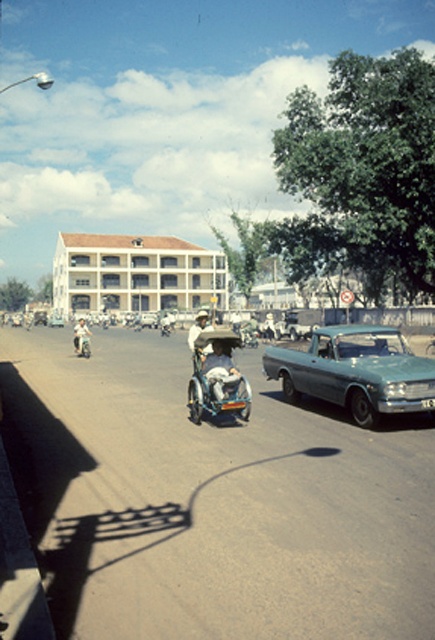
Looking at this image, can you confirm if light brown leather jacket at center is positioned to the right of light brown leather helmet at center?

Yes, light brown leather jacket at center is to the right of light brown leather helmet at center.

Who is positioned more to the left, light brown leather jacket at center or light brown leather helmet at center?

light brown leather helmet at center

Where is `light brown leather jacket at center`? light brown leather jacket at center is located at coordinates (197, 328).

Find the location of a particular element. The height and width of the screenshot is (640, 435). light brown leather jacket at center is located at coordinates (197, 328).

Is teal metallic car at right thinner than light brown leather jacket at center?

Yes, teal metallic car at right is thinner than light brown leather jacket at center.

Does teal metallic car at right appear on the left side of light brown leather jacket at center?

In fact, teal metallic car at right is to the right of light brown leather jacket at center.

Does point (284, 353) come behind point (201, 330)?

Yes, it is.

Locate an element on the screen. Image resolution: width=435 pixels, height=640 pixels. teal metallic car at right is located at coordinates (355, 371).

Which of these two, teal metallic car at right or white leather helmet at center, stands taller?

Standing taller between the two is white leather helmet at center.

Locate an element on the screen. teal metallic car at right is located at coordinates 355,371.

Who is more forward, (x=293, y=394) or (x=223, y=364)?

Point (x=223, y=364) is in front.

Where is `teal metallic car at right`? This screenshot has width=435, height=640. teal metallic car at right is located at coordinates (355, 371).